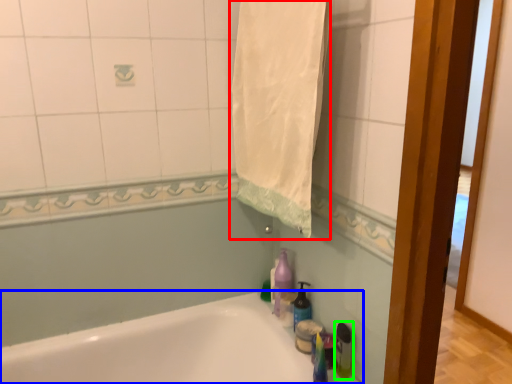
Question: Which object is the closest to the bath towel (highlighted by a red box)? Choose among these: bathtub (highlighted by a blue box) or bottle (highlighted by a green box).

Choices:
 (A) bathtub
 (B) bottle

Answer: (B)